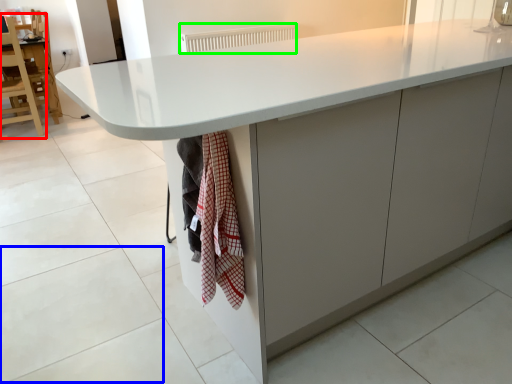
Question: Which object is the farthest from chair (highlighted by a red box)? Choose among these: granite (highlighted by a blue box) or radiator (highlighted by a green box).

Choices:
 (A) granite
 (B) radiator

Answer: (A)